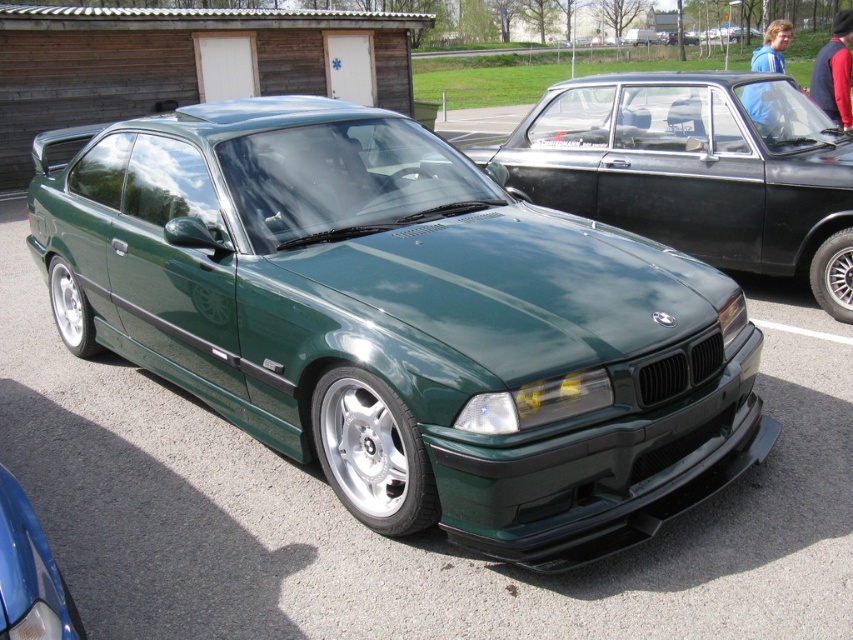
Question: Can you confirm if green metallic car at center is smaller than green matte car at center?

Choices:
 (A) no
 (B) yes

Answer: (A)

Question: Which point is farther from the camera taking this photo?

Choices:
 (A) (572, 380)
 (B) (584, 141)
 (C) (25, 612)

Answer: (B)

Question: Which is nearer to the metallic blue car at lower left?

Choices:
 (A) green matte car at center
 (B) green metallic car at center

Answer: (B)

Question: Does green metallic car at center have a larger size compared to metallic blue car at lower left?

Choices:
 (A) yes
 (B) no

Answer: (A)

Question: Which point is closer to the camera?

Choices:
 (A) click(x=630, y=273)
 (B) click(x=701, y=83)
 (C) click(x=62, y=605)

Answer: (C)

Question: Is green matte car at center positioned before metallic blue car at lower left?

Choices:
 (A) no
 (B) yes

Answer: (A)